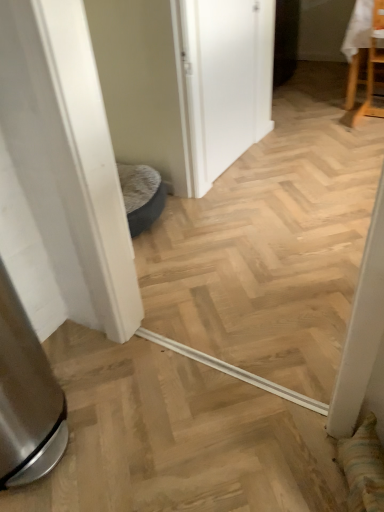
You are a GUI agent. You are given a task and a screenshot of the screen. Output one action in this format:
    pyautogui.click(x=<x>, y=<y>)
    Task: Click on the vacant space positioned to the left of wooden chair at upper right
    
    Given the screenshot: What is the action you would take?
    pyautogui.click(x=320, y=119)